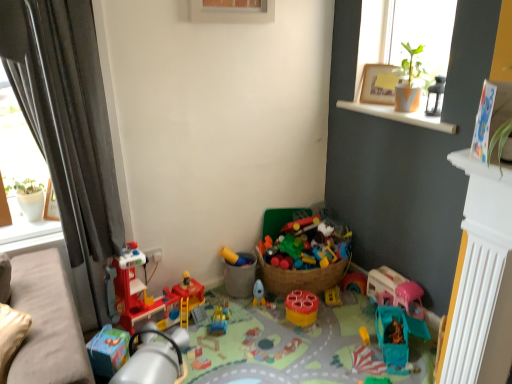
Describe the element at coordinates (401, 115) in the screenshot. I see `white wood window sill at upper right` at that location.

What is the approximate height of wooden frame at upper right?

wooden frame at upper right is 23.96 centimeters in height.

You are a GUI agent. You are given a task and a screenshot of the screen. Output one action in this format:
    pyautogui.click(x=<x>, y=<y>)
    Task: Click on the wooden frame at upper right
    The height and width of the screenshot is (384, 512).
    Given the screenshot: What is the action you would take?
    pyautogui.click(x=379, y=84)

The height and width of the screenshot is (384, 512). I want to click on matte plastic cup at center, the sixth toy from the left, so point(301,307).

Describe the element at coordinates (67, 121) in the screenshot. This screenshot has width=512, height=384. I see `gray fabric curtain at left` at that location.

What do you see at coordinates (47, 323) in the screenshot? The width and height of the screenshot is (512, 384). I see `beige fabric couch at lower left` at bounding box center [47, 323].

Where is `pink plastic toy at lower right, the 7th toy from the left`? This screenshot has width=512, height=384. pink plastic toy at lower right, the 7th toy from the left is located at coordinates (395, 290).

Are matte plastic playset at left, which is the seventh toy from right to left, and beige fabric couch at lower left far apart?

No, matte plastic playset at left, which is the seventh toy from right to left, is in close proximity to beige fabric couch at lower left.

From the image's perspective, would you say matte plastic playset at left, which is the 1th toy in left-to-right order, is positioned over beige fabric couch at lower left?

Indeed, from the image's perspective, matte plastic playset at left, which is the 1th toy in left-to-right order, is shown above beige fabric couch at lower left.

How many degrees apart are the facing directions of matte plastic playset at left, which is the 1th toy in left-to-right order, and beige fabric couch at lower left?

42.8 degrees separate the facing orientations of matte plastic playset at left, which is the 1th toy in left-to-right order, and beige fabric couch at lower left.

Considering the sizes of matte plastic playset at left, which is the 1th toy in left-to-right order, and beige fabric couch at lower left in the image, is matte plastic playset at left, which is the 1th toy in left-to-right order, bigger or smaller than beige fabric couch at lower left?

Considering their sizes, matte plastic playset at left, which is the 1th toy in left-to-right order, takes up more space than beige fabric couch at lower left.

Is plastic construction set at center, the third toy when ordered from right to left, facing away from beige fabric couch at lower left?

No.

Identify the location of toy that is the 7th object directly below the beige fabric couch at lower left (from a real-world perspective). Image resolution: width=512 pixels, height=384 pixels. (302, 347).

Which of these two, plastic construction set at center, placed as the 5th toy when sorted from left to right, or beige fabric couch at lower left, stands taller?

beige fabric couch at lower left is taller.

Measure the distance between pink plastic toy at lower right, positioned as the 1th toy in right-to-left order, and translucent plastic slide at center, which is the second toy from left to right.

The distance of pink plastic toy at lower right, positioned as the 1th toy in right-to-left order, from translucent plastic slide at center, which is the second toy from left to right, is 36.77 inches.

Between pink plastic toy at lower right, positioned as the 1th toy in right-to-left order, and translucent plastic slide at center, placed as the 6th toy when sorted from right to left, which one is positioned behind?

translucent plastic slide at center, placed as the 6th toy when sorted from right to left, is behind.

Does pink plastic toy at lower right, the 7th toy from the left, have a larger size compared to translucent plastic slide at center, placed as the 6th toy when sorted from right to left?

Yes.

Is pink plastic toy at lower right, the 7th toy from the left, to the right of translucent plastic slide at center, which is the second toy from left to right, from the viewer's perspective?

Correct, you'll find pink plastic toy at lower right, the 7th toy from the left, to the right of translucent plastic slide at center, which is the second toy from left to right.

From a real-world perspective, is plastic construction set at center, the third toy when ordered from right to left, physically located above or below gray fabric curtain at left?

From a real-world perspective, plastic construction set at center, the third toy when ordered from right to left, is physically below gray fabric curtain at left.

Could you tell me if plastic construction set at center, the third toy when ordered from right to left, is facing gray fabric curtain at left?

No, plastic construction set at center, the third toy when ordered from right to left, does not turn towards gray fabric curtain at left.

Between plastic construction set at center, the third toy when ordered from right to left, and gray fabric curtain at left, which one has more height?

With more height is gray fabric curtain at left.

Which is closer to the camera, (322, 359) or (63, 45)?

The point (63, 45) is closer to the camera.

From the image's perspective, would you say white plastic radiator at lower right is positioned over matte yellow plastic toy at center, acting as the fourth toy starting from the left?

Yes.

Is white plastic radiator at lower right facing away from matte yellow plastic toy at center, which ranks as the 4th toy in right-to-left order?

white plastic radiator at lower right does not have its back to matte yellow plastic toy at center, which ranks as the 4th toy in right-to-left order.

Considering the sizes of white plastic radiator at lower right and matte yellow plastic toy at center, acting as the fourth toy starting from the left, in the image, is white plastic radiator at lower right wider or thinner than matte yellow plastic toy at center, acting as the fourth toy starting from the left,?

In the image, white plastic radiator at lower right appears to be more narrow than matte yellow plastic toy at center, acting as the fourth toy starting from the left.

Who is shorter, white plastic radiator at lower right or matte yellow plastic toy at center, acting as the fourth toy starting from the left?

With less height is matte yellow plastic toy at center, acting as the fourth toy starting from the left.

Locate an element on the screen. radiator in front of the matte plastic playset at left, which is the seventh toy from right to left is located at coordinates (480, 312).

Considering the points (475, 235) and (184, 284), which point is in front, point (475, 235) or point (184, 284)?

Positioned in front is point (475, 235).

Would you say white plastic radiator at lower right is to the left or to the right of matte plastic playset at left, which is the seventh toy from right to left, in the picture?

Clearly, white plastic radiator at lower right is on the right of matte plastic playset at left, which is the seventh toy from right to left, in the image.

Considering the sizes of objects white plastic radiator at lower right and matte plastic playset at left, which is the seventh toy from right to left, in the image provided, who is thinner, white plastic radiator at lower right or matte plastic playset at left, which is the seventh toy from right to left,?

With smaller width is white plastic radiator at lower right.

Is matte yellow plastic toy at center, acting as the fourth toy starting from the left, a part of matte plastic cup at center, which is the 2th toy in right-to-left order?

No.

Based on the photo, is matte plastic cup at center, which is the 2th toy in right-to-left order, thinner than matte yellow plastic toy at center, acting as the fourth toy starting from the left?

Indeed, matte plastic cup at center, which is the 2th toy in right-to-left order, has a lesser width compared to matte yellow plastic toy at center, acting as the fourth toy starting from the left.

From the image's perspective, is matte plastic cup at center, which is the 2th toy in right-to-left order, positioned above or below matte yellow plastic toy at center, acting as the fourth toy starting from the left?

Clearly, from the image's perspective, matte plastic cup at center, which is the 2th toy in right-to-left order, is below matte yellow plastic toy at center, acting as the fourth toy starting from the left.

Are matte plastic cup at center, which is the 2th toy in right-to-left order, and matte yellow plastic toy at center, acting as the fourth toy starting from the left, beside each other?

No, matte plastic cup at center, which is the 2th toy in right-to-left order, is not in contact with matte yellow plastic toy at center, acting as the fourth toy starting from the left.

Find the location of a particular element. furniture above the matte plastic playset at left, which is the seventh toy from right to left (from a real-world perspective) is located at coordinates (47, 323).

Where is `furniture that is above the plastic construction set at center, placed as the 5th toy when sorted from left to right (from the image's perspective)`? Image resolution: width=512 pixels, height=384 pixels. furniture that is above the plastic construction set at center, placed as the 5th toy when sorted from left to right (from the image's perspective) is located at coordinates (47, 323).

From the image, which object appears to be nearer to white wood window sill at upper right, wooden frame at upper right or white plastic radiator at lower right?

wooden frame at upper right lies closer to white wood window sill at upper right than the other object.

Which object lies further to the anchor point matte yellow plastic toy at center, acting as the fourth toy starting from the left, translucent plastic slide at center, placed as the 6th toy when sorted from right to left, or beige fabric couch at lower left?

beige fabric couch at lower left.

Looking at the image, which one is located further to translucent plastic slide at center, placed as the 6th toy when sorted from right to left, wooden frame at upper right or matte plastic playset at left, which is the seventh toy from right to left?

wooden frame at upper right lies further to translucent plastic slide at center, placed as the 6th toy when sorted from right to left, than the other object.

From the image, which object appears to be nearer to matte yellow plastic toy at center, acting as the fourth toy starting from the left, white plastic radiator at lower right or wooden frame at upper right?

Based on the image, wooden frame at upper right appears to be nearer to matte yellow plastic toy at center, acting as the fourth toy starting from the left.

Based on their spatial positions, is matte plastic cup at center, the sixth toy from the left, or pink plastic toy at lower right, positioned as the 1th toy in right-to-left order, closer to wooden frame at upper right?

pink plastic toy at lower right, positioned as the 1th toy in right-to-left order, is closer to wooden frame at upper right.

Estimate the real-world distances between objects in this image. Which object is closer to gray fabric curtain at left, rubber yellow toy at center, positioned as the third toy in left-to-right order, or matte yellow plastic toy at center, acting as the fourth toy starting from the left?

matte yellow plastic toy at center, acting as the fourth toy starting from the left.

Considering their positions, is beige fabric couch at lower left positioned further to wooden frame at upper right than pink plastic toy at lower right, the 7th toy from the left?

beige fabric couch at lower left lies further to wooden frame at upper right than the other object.

Considering their positions, is wooden frame at upper right positioned closer to beige fabric couch at lower left than rubber yellow toy at center, positioned as the third toy in left-to-right order?

The object closer to beige fabric couch at lower left is rubber yellow toy at center, positioned as the third toy in left-to-right order.

Identify the location of picture frame between white plastic radiator at lower right and rubber yellow toy at center, the 5th toy positioned from the right, along the z-axis. This screenshot has width=512, height=384. (379, 84).

Identify the location of curtain between beige fabric couch at lower left and white wood window sill at upper right. (67, 121).

The width and height of the screenshot is (512, 384). Find the location of `window sill between white plastic radiator at lower right and pink plastic toy at lower right, positioned as the 1th toy in right-to-left order, from front to back`. window sill between white plastic radiator at lower right and pink plastic toy at lower right, positioned as the 1th toy in right-to-left order, from front to back is located at coordinates (401, 115).

Where is `picture frame between matte plastic playset at left, which is the seventh toy from right to left, and pink plastic toy at lower right, the 7th toy from the left`? The image size is (512, 384). picture frame between matte plastic playset at left, which is the seventh toy from right to left, and pink plastic toy at lower right, the 7th toy from the left is located at coordinates (379, 84).